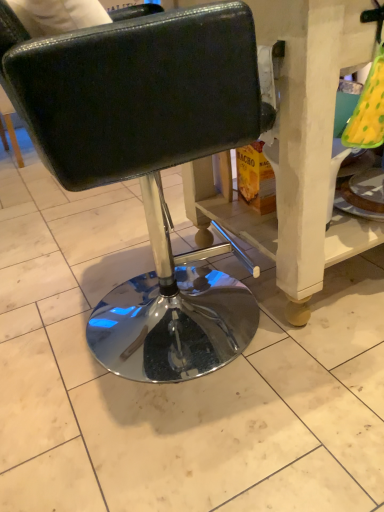
Where is `free space in front of black leather chair at center`? free space in front of black leather chair at center is located at coordinates (185, 446).